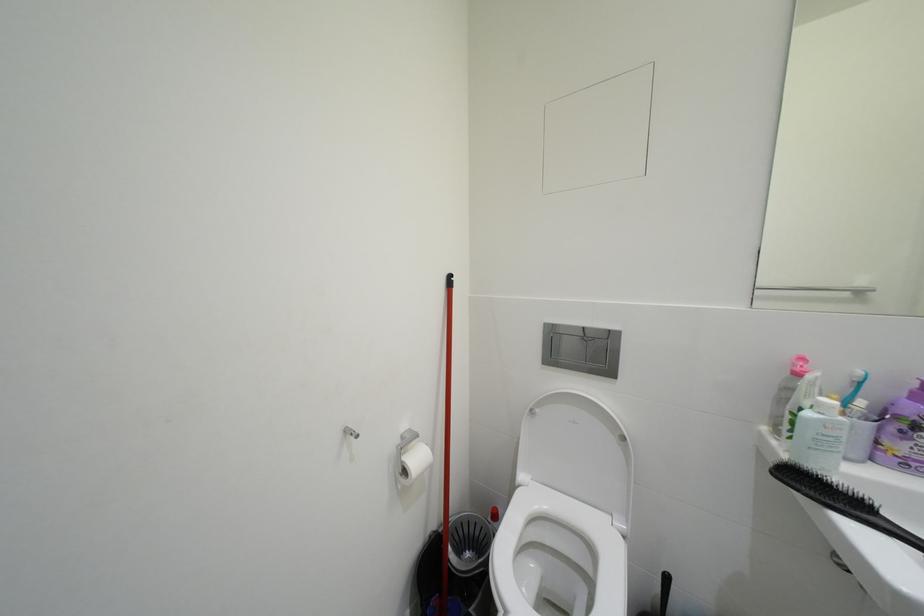
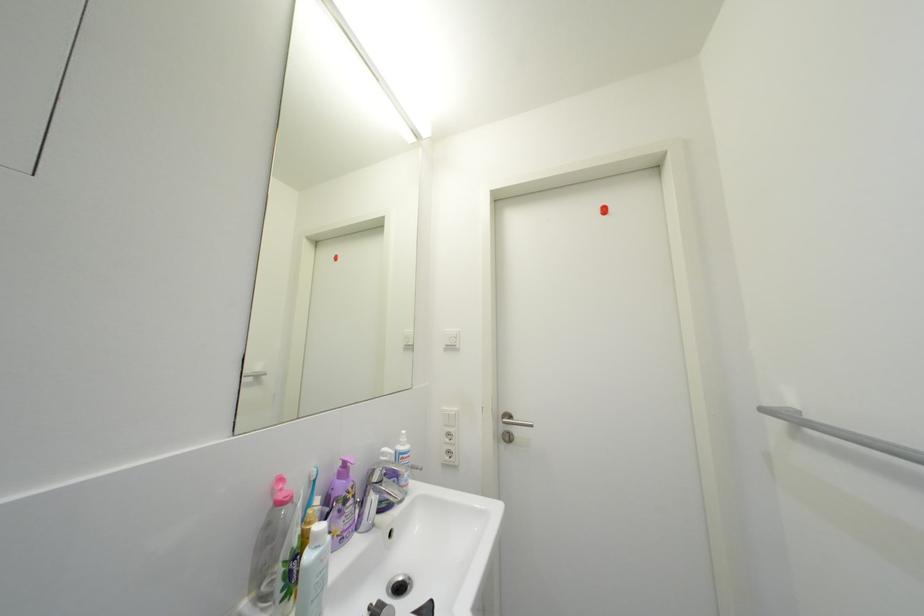
Question: Based on the continuous images, in which direction is the camera rotating? Reply with the corresponding letter.

Choices:
 (A) Left
 (B) Right
 (C) Up
 (D) Down

Answer: (B)